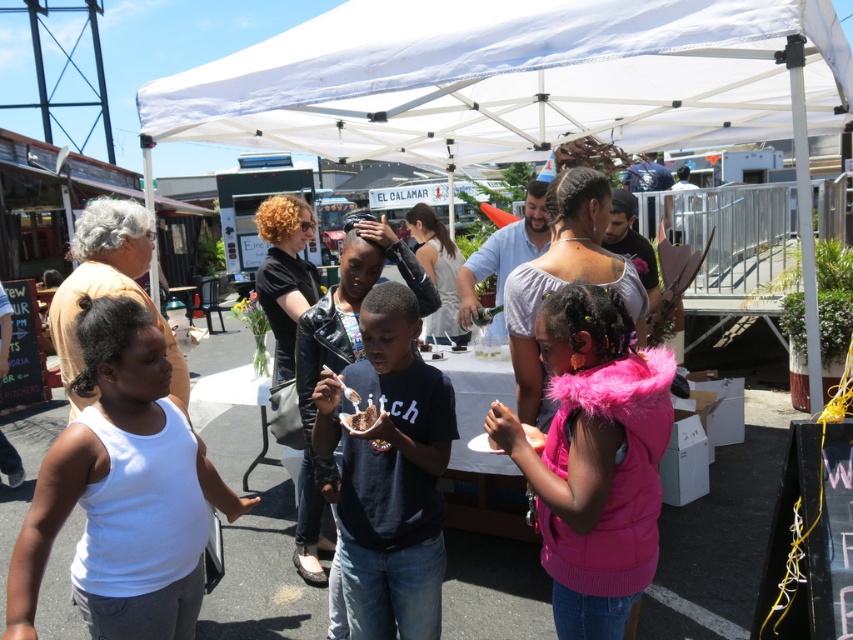
Which of these two, white fabric canopy at upper center or chocolate cake at center, stands taller?

Standing taller between the two is white fabric canopy at upper center.

The width and height of the screenshot is (853, 640). I want to click on white fabric canopy at upper center, so click(x=509, y=77).

Does point (569, 92) come farther from viewer compared to point (376, 406)?

Yes, point (569, 92) is farther from viewer.

This screenshot has height=640, width=853. In order to click on white fabric canopy at upper center in this screenshot , I will do `click(509, 77)`.

Does white fabric canopy at upper center have a smaller size compared to black matte shirt at center?

No.

At what (x,y) coordinates should I click in order to perform the action: click on white fabric canopy at upper center. Please return your answer as a coordinate pair (x, y). The height and width of the screenshot is (640, 853). Looking at the image, I should click on (509, 77).

Can you confirm if black matte shirt at center is positioned to the right of chocolate cake at center?

Correct, you'll find black matte shirt at center to the right of chocolate cake at center.

Who is more distant from viewer, (383, 467) or (349, 419)?

The point (383, 467) is more distant.

Measure the distance between black matte shirt at center and camera.

black matte shirt at center and camera are 7.45 feet apart.

At what (x,y) coordinates should I click in order to perform the action: click on black matte shirt at center. Please return your answer as a coordinate pair (x, y). This screenshot has width=853, height=640. Looking at the image, I should click on (389, 474).